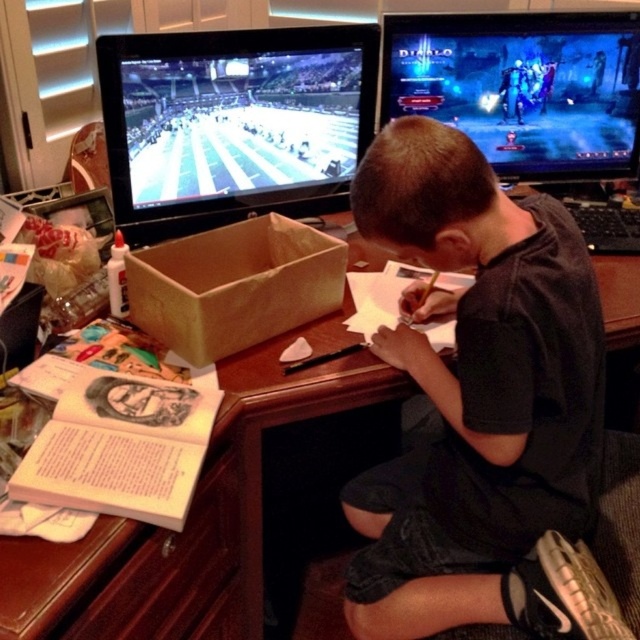
Does black cotton shirt at center have a greater height compared to brown paper box at center?

Indeed, black cotton shirt at center has a greater height compared to brown paper box at center.

Who is more forward, (380, 132) or (250, 259)?

Point (380, 132) is in front.

This screenshot has height=640, width=640. What are the coordinates of `black cotton shirt at center` in the screenshot? It's located at (481, 404).

Which of these two, brown paper box at center or white wood drawer at lower left, stands taller?

Standing taller between the two is white wood drawer at lower left.

This screenshot has height=640, width=640. Find the location of `brown paper box at center`. brown paper box at center is located at coordinates (234, 285).

Is point (140, 548) behind point (204, 61)?

That is False.

Can you confirm if wooden at center is wider than shiny plastic screen at upper left?

Indeed, wooden at center has a greater width compared to shiny plastic screen at upper left.

Does point (628, 307) come behind point (257, 113)?

No, (628, 307) is closer to viewer.

The height and width of the screenshot is (640, 640). What are the coordinates of `wooden at center` in the screenshot? It's located at (195, 509).